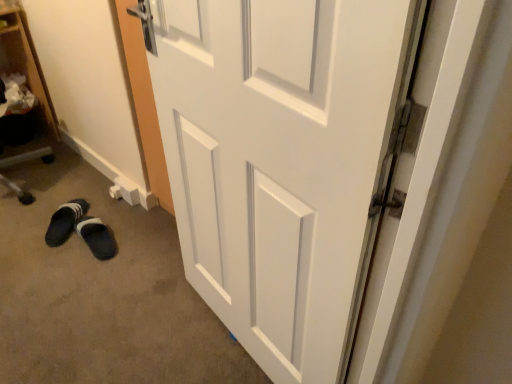
What do you see at coordinates (65, 221) in the screenshot? This screenshot has width=512, height=384. I see `black fabric slipper at lower left` at bounding box center [65, 221].

The image size is (512, 384). I want to click on black fabric slipper at lower left, so click(x=65, y=221).

Does black fabric slipper at lower left come in front of white glossy door at center?

No, the depth of black fabric slipper at lower left is greater than that of white glossy door at center.

Considering the sizes of objects black fabric slipper at lower left and white glossy door at center in the image provided, who is bigger, black fabric slipper at lower left or white glossy door at center?

With larger size is white glossy door at center.

Is black fabric slipper at lower left turned away from white glossy door at center?

That's not correct — black fabric slipper at lower left is not looking away from white glossy door at center.

Locate an element on the screen. The width and height of the screenshot is (512, 384). door on the right of black fabric slipper at lower left is located at coordinates (281, 160).

Is white glossy door at center taller or shorter than black fabric slipper at lower left?

Considering their sizes, white glossy door at center has more height than black fabric slipper at lower left.

From the image's perspective, relative to black fabric slipper at lower left, is white glossy door at center above or below?

Clearly, from the image's perspective, white glossy door at center is above black fabric slipper at lower left.

From a real-world perspective, is white glossy door at center positioned over black fabric slipper at lower left based on gravity?

Yes, from a real-world perspective, white glossy door at center is above black fabric slipper at lower left.

Is white glossy door at center far away from black fabric slipper at lower left?

white glossy door at center is positioned a significant distance from black fabric slipper at lower left.

Is point (106, 236) positioned after point (13, 123)?

No, (106, 236) is in front of (13, 123).

From the image's perspective, is black suede slipper at lower left beneath wooden bookshelf at left?

Yes, from the image's perspective, black suede slipper at lower left is beneath wooden bookshelf at left.

Where is `bookshelf in front of the black suede slipper at lower left`? Image resolution: width=512 pixels, height=384 pixels. bookshelf in front of the black suede slipper at lower left is located at coordinates (24, 89).

Who is more distant, black suede slipper at lower left or wooden bookshelf at left?

black suede slipper at lower left is further from the camera.

Does white glossy door at center have a larger size compared to wooden bookshelf at left?

No, white glossy door at center is not bigger than wooden bookshelf at left.

This screenshot has width=512, height=384. I want to click on door that is in front of the wooden bookshelf at left, so click(x=281, y=160).

Consider the image. Is wooden bookshelf at left a part of white glossy door at center?

No, wooden bookshelf at left is located outside of white glossy door at center.

Looking at their sizes, would you say white glossy door at center is wider or thinner than wooden bookshelf at left?

white glossy door at center is thinner than wooden bookshelf at left.

Can you confirm if black suede slipper at lower left is bigger than black fabric slipper at lower left?

Incorrect, black suede slipper at lower left is not larger than black fabric slipper at lower left.

How many degrees apart are the facing directions of black suede slipper at lower left and black fabric slipper at lower left?

They differ by 42.9 degrees in their facing directions.

Based on the photo, who is taller, black suede slipper at lower left or black fabric slipper at lower left?

With more height is black fabric slipper at lower left.

Is black suede slipper at lower left inside the boundaries of black fabric slipper at lower left, or outside?

black suede slipper at lower left is not inside black fabric slipper at lower left, it's outside.

In terms of width, does black suede slipper at lower left look wider or thinner when compared to white glossy door at center?

Result: black suede slipper at lower left is wider than white glossy door at center.

Considering the relative sizes of black suede slipper at lower left and white glossy door at center in the image provided, is black suede slipper at lower left smaller than white glossy door at center?

Yes, black suede slipper at lower left is smaller than white glossy door at center.

From the image's perspective, is black suede slipper at lower left positioned above or below white glossy door at center?

black suede slipper at lower left is situated lower than white glossy door at center in the image.

Is black suede slipper at lower left looking in the opposite direction of white glossy door at center?

No, black suede slipper at lower left is not facing away from white glossy door at center.

From the picture: From the image's perspective, is wooden bookshelf at left above or below black suede slipper at lower left?

wooden bookshelf at left is situated higher than black suede slipper at lower left in the image.

Locate an element on the screen. The height and width of the screenshot is (384, 512). shoe that appears below the wooden bookshelf at left (from the image's perspective) is located at coordinates (81, 229).

Would you say wooden bookshelf at left contains black suede slipper at lower left?

No, black suede slipper at lower left is located outside of wooden bookshelf at left.

Based on the photo, would you consider wooden bookshelf at left to be distant from black suede slipper at lower left?

No.

In order to click on footwear below the white glossy door at center (from a real-world perspective) in this screenshot , I will do `click(65, 221)`.

Image resolution: width=512 pixels, height=384 pixels. Find the location of `door that appears in front of the black fabric slipper at lower left`. door that appears in front of the black fabric slipper at lower left is located at coordinates (281, 160).

When comparing their distances from black suede slipper at lower left, does wooden bookshelf at left or black fabric slipper at lower left seem further?

wooden bookshelf at left.

Which object lies further to the anchor point wooden bookshelf at left, black suede slipper at lower left or white glossy door at center?

white glossy door at center is further to wooden bookshelf at left.

Which object lies further to the anchor point wooden bookshelf at left, white glossy door at center or black fabric slipper at lower left?

white glossy door at center is positioned further to the anchor wooden bookshelf at left.

When comparing their distances from white glossy door at center, does wooden bookshelf at left or black fabric slipper at lower left seem further?

wooden bookshelf at left is further to white glossy door at center.

Looking at the image, which one is located closer to wooden bookshelf at left, black fabric slipper at lower left or white glossy door at center?

The object closer to wooden bookshelf at left is black fabric slipper at lower left.

Estimate the real-world distances between objects in this image. Which object is closer to black fabric slipper at lower left, black suede slipper at lower left or white glossy door at center?

Based on the image, black suede slipper at lower left appears to be nearer to black fabric slipper at lower left.

From the image, which object appears to be nearer to black fabric slipper at lower left, white glossy door at center or black suede slipper at lower left?

The object closer to black fabric slipper at lower left is black suede slipper at lower left.

Which object lies nearer to the anchor point black suede slipper at lower left, white glossy door at center or black fabric slipper at lower left?

Based on the image, black fabric slipper at lower left appears to be nearer to black suede slipper at lower left.

Locate an element on the screen. The image size is (512, 384). shoe between white glossy door at center and black fabric slipper at lower left in the front-back direction is located at coordinates (81, 229).

At what (x,y) coordinates should I click in order to perform the action: click on bookshelf between white glossy door at center and black fabric slipper at lower left along the z-axis. Please return your answer as a coordinate pair (x, y). The width and height of the screenshot is (512, 384). Looking at the image, I should click on (24, 89).

Find the location of a particular element. The image size is (512, 384). bookshelf between white glossy door at center and black suede slipper at lower left in the front-back direction is located at coordinates (24, 89).

This screenshot has width=512, height=384. In order to click on footwear between wooden bookshelf at left and black suede slipper at lower left from left to right in this screenshot , I will do `click(65, 221)`.